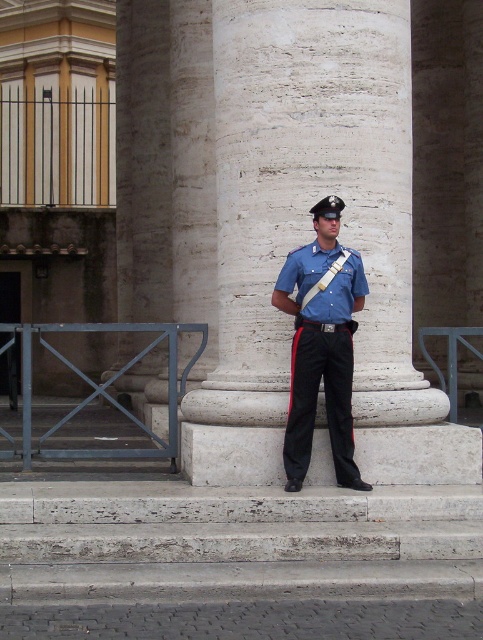
Question: Can you confirm if white marble column at center is positioned to the right of blue uniform at center?

Choices:
 (A) no
 (B) yes

Answer: (B)

Question: Is white marble column at center above blue uniform at center?

Choices:
 (A) no
 (B) yes

Answer: (B)

Question: Estimate the real-world distances between objects in this image. Which object is farther from the blue uniform at center?

Choices:
 (A) white marble column at center
 (B) white stone steps at center

Answer: (B)

Question: Is white marble column at center smaller than white stone steps at center?

Choices:
 (A) yes
 (B) no

Answer: (B)

Question: Among these objects, which one is farthest from the camera?

Choices:
 (A) blue uniform at center
 (B) white marble column at center

Answer: (B)

Question: Which point is closer to the camera taking this photo?

Choices:
 (A) (290, 72)
 (B) (181, 580)

Answer: (B)